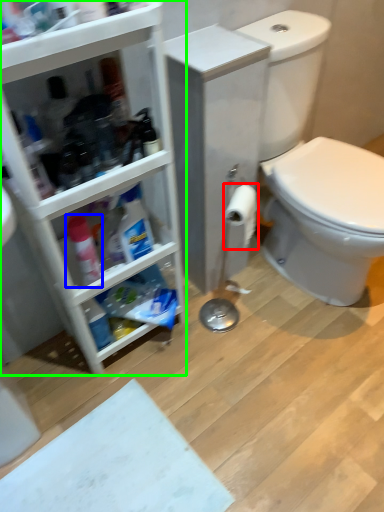
Question: Estimate the real-world distances between objects in this image. Which object is closer to toilet paper (highlighted by a red box), cleaning product (highlighted by a blue box) or bathroom cabinet (highlighted by a green box)?

Choices:
 (A) cleaning product
 (B) bathroom cabinet

Answer: (B)